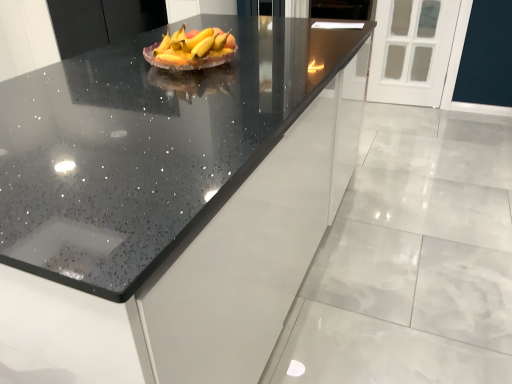
Question: Is yellow matte grapefruit at center wider or thinner than black speckled countertop at center?

Choices:
 (A) thin
 (B) wide

Answer: (A)

Question: Is yellow matte grapefruit at center spatially inside black speckled countertop at center, or outside of it?

Choices:
 (A) inside
 (B) outside

Answer: (B)

Question: Which object is positioned closest to the black speckled countertop at center?

Choices:
 (A) yellow matte grapefruit at center
 (B) black speckled countertop at center

Answer: (B)

Question: Which object is the farthest from the black speckled countertop at center?

Choices:
 (A) yellow matte grapefruit at center
 (B) black speckled countertop at center

Answer: (A)